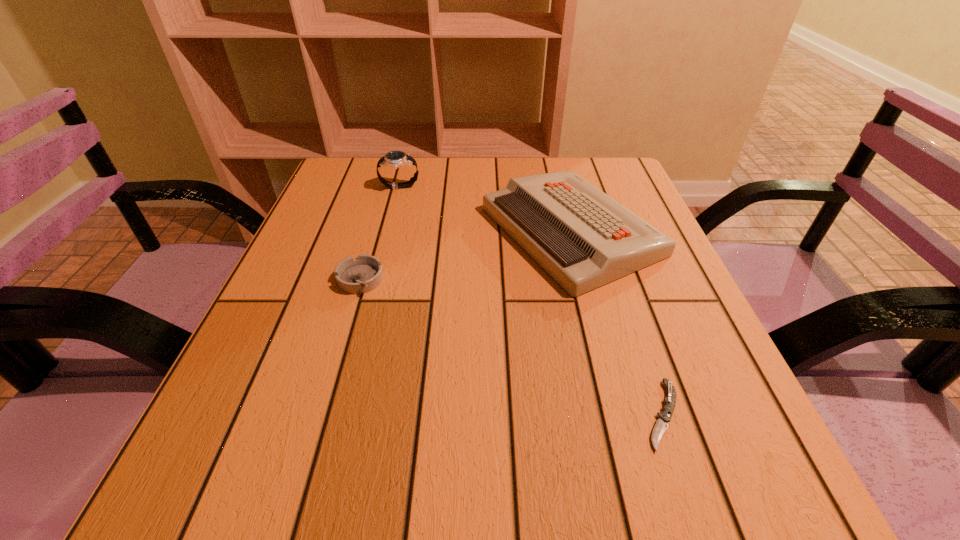
In the image, there is a desktop. Where is `vacant space at the near edge`? This screenshot has width=960, height=540. vacant space at the near edge is located at coordinates (485, 487).

Identify the location of vacant space at the left edge of the desktop. This screenshot has width=960, height=540. (326, 285).

The image size is (960, 540). What are the coordinates of `vacant point at the right edge` in the screenshot? It's located at (666, 294).

Locate an element on the screen. vacant area at the far left corner is located at coordinates (369, 176).

In order to click on vacant space at the near left corner in this screenshot , I will do `click(238, 515)`.

In the image, there is a desktop. Find the location of `free space at the far right corner`. free space at the far right corner is located at coordinates (598, 174).

Find the location of a particular element. free point between the pocketknife and the watch is located at coordinates (531, 301).

You are a GUI agent. You are given a task and a screenshot of the screen. Output one action in this format:
    pyautogui.click(x=<x>, y=<y>)
    Task: Click on the free space that is in between the nearest object and the third shortest object
    This screenshot has width=960, height=540.
    Given the screenshot: What is the action you would take?
    pyautogui.click(x=617, y=323)

This screenshot has height=540, width=960. Identify the location of empty space that is in between the shortest object and the tallest object. point(531,301).

The height and width of the screenshot is (540, 960). I want to click on free space that is in between the ashtray and the shortest object, so click(x=512, y=347).